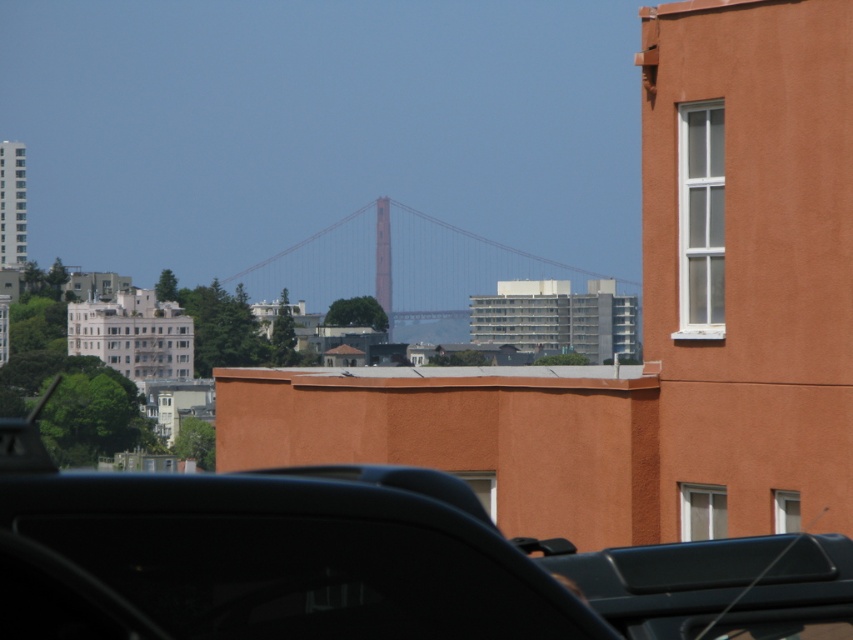
Question: Is shiny black car at center above red painted steel suspension bridge at center?

Choices:
 (A) no
 (B) yes

Answer: (A)

Question: Which of the following is the farthest from the observer?

Choices:
 (A) red painted steel suspension bridge at center
 (B) shiny black car at center

Answer: (A)

Question: Can you confirm if shiny black car at center is positioned to the right of red painted steel suspension bridge at center?

Choices:
 (A) no
 (B) yes

Answer: (B)

Question: Does shiny black car at center appear on the left side of red painted steel suspension bridge at center?

Choices:
 (A) no
 (B) yes

Answer: (A)

Question: Which point appears closest to the camera in this image?

Choices:
 (A) (61, 502)
 (B) (434, 301)

Answer: (A)